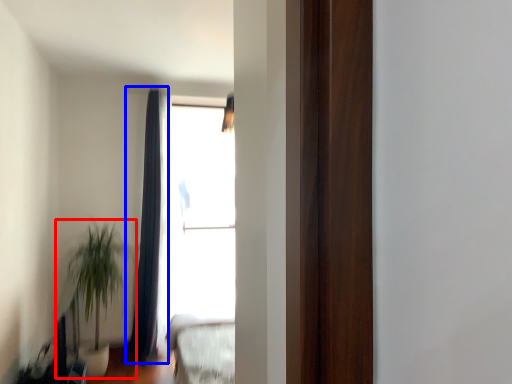
Question: Which object appears closest to the camera in this image, houseplant (highlighted by a red box) or curtain (highlighted by a blue box)?

Choices:
 (A) houseplant
 (B) curtain

Answer: (A)